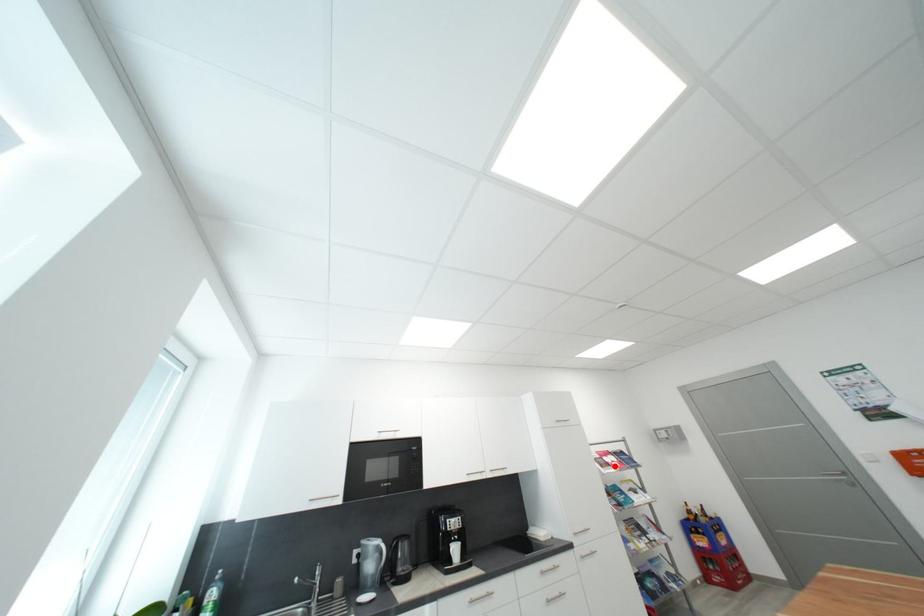
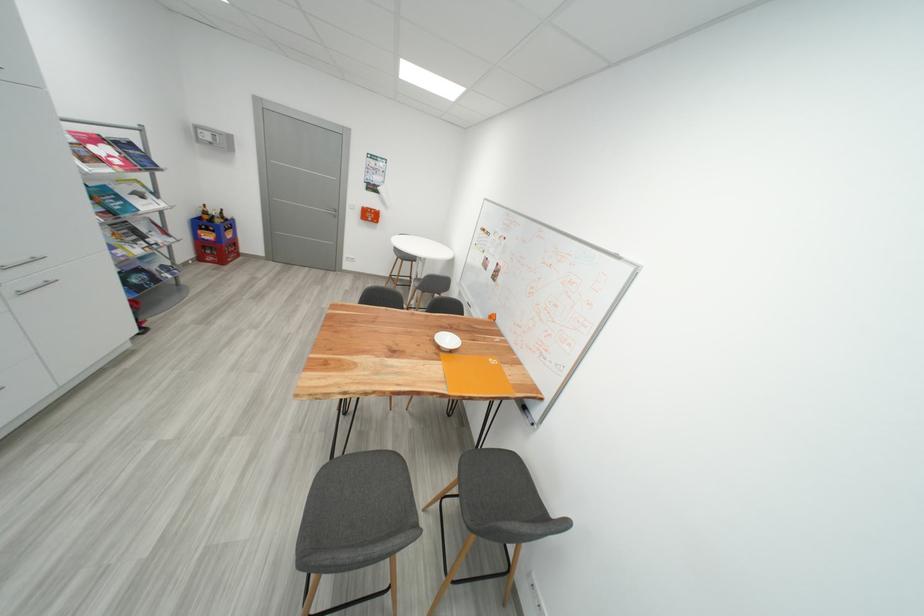
Find the pixel in the second image that matches the highlighted location in the first image.

(104, 161)